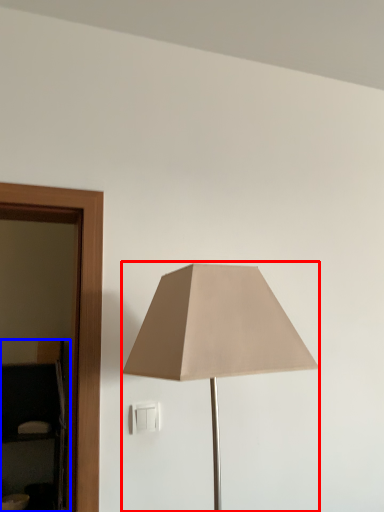
Question: Among these objects, which one is nearest to the camera, lamp (highlighted by a red box) or dresser (highlighted by a blue box)?

Choices:
 (A) lamp
 (B) dresser

Answer: (A)